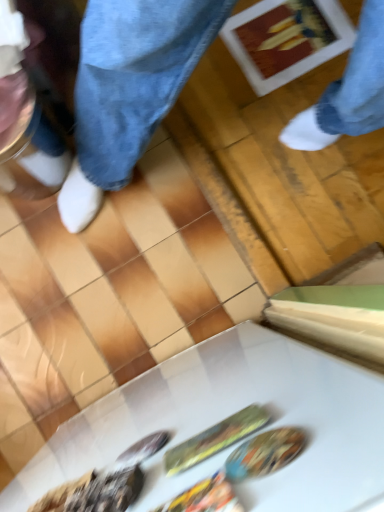
Question: Are shiny plastic bag at center, the second food from the left, and white glossy table at lower center making contact?

Choices:
 (A) no
 (B) yes

Answer: (A)

Question: From a real-world perspective, is shiny plastic bag at center, the second food from the left, below white glossy table at lower center?

Choices:
 (A) no
 (B) yes

Answer: (A)

Question: Is shiny plastic bag at center, positioned as the second food in right-to-left order, bigger than white glossy table at lower center?

Choices:
 (A) yes
 (B) no

Answer: (B)

Question: Is shiny plastic bag at center, the second food from the left, positioned before white glossy table at lower center?

Choices:
 (A) yes
 (B) no

Answer: (B)

Question: Considering the relative sizes of shiny plastic bag at center, positioned as the second food in right-to-left order, and white glossy table at lower center in the image provided, is shiny plastic bag at center, positioned as the second food in right-to-left order, wider than white glossy table at lower center?

Choices:
 (A) no
 (B) yes

Answer: (A)

Question: From the image's perspective, is shiny metallic spoon at lower left, the third food from the right, above or below shiny plastic bag at center, the second food from the left?

Choices:
 (A) below
 (B) above

Answer: (A)

Question: In the image, is shiny metallic spoon at lower left, placed as the first food when sorted from left to right, positioned in front of or behind shiny plastic bag at center, the second food from the left?

Choices:
 (A) front
 (B) behind

Answer: (B)

Question: Would you say shiny metallic spoon at lower left, the third food from the right, is to the left or to the right of shiny plastic bag at center, the second food from the left, in the picture?

Choices:
 (A) right
 (B) left

Answer: (B)

Question: Looking at their shapes, would you say shiny metallic spoon at lower left, the third food from the right, is wider or thinner than shiny plastic bag at center, the second food from the left?

Choices:
 (A) wide
 (B) thin

Answer: (B)

Question: In terms of size, does shiny metallic spoon at lower left, the third food from the right, appear bigger or smaller than white glossy table at lower center?

Choices:
 (A) small
 (B) big

Answer: (A)

Question: From the image's perspective, is shiny metallic spoon at lower left, placed as the first food when sorted from left to right, located above or below white glossy table at lower center?

Choices:
 (A) above
 (B) below

Answer: (A)

Question: Is shiny metallic spoon at lower left, placed as the first food when sorted from left to right, spatially inside white glossy table at lower center, or outside of it?

Choices:
 (A) inside
 (B) outside

Answer: (A)

Question: Looking at their shapes, would you say shiny metallic spoon at lower left, the third food from the right, is wider or thinner than white glossy table at lower center?

Choices:
 (A) wide
 (B) thin

Answer: (B)

Question: Which is correct: shiny plastic spoon at center, arranged as the first food when viewed from the right, is inside shiny metallic spoon at lower left, placed as the first food when sorted from left to right, or outside of it?

Choices:
 (A) inside
 (B) outside

Answer: (B)

Question: Is shiny plastic spoon at center, which ranks as the third food in left-to-right order, in front of or behind shiny metallic spoon at lower left, the third food from the right, in the image?

Choices:
 (A) front
 (B) behind

Answer: (B)